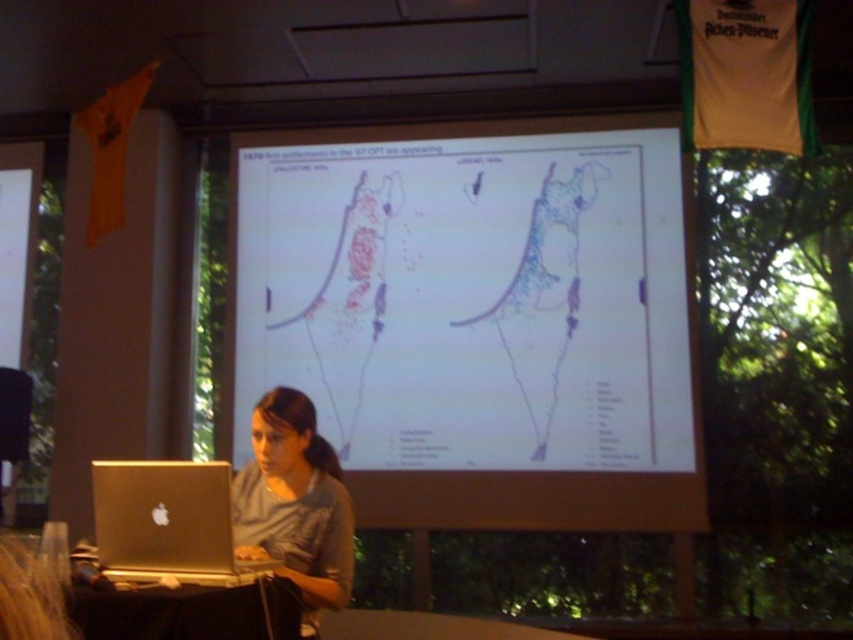
You are standing in the presentation room and see two points on the projection screen. The first point is labeled as point 1 at coordinates point (578, 316) and the second point is labeled as point 2 at coordinates point (204, 500). Which point is closer to you?

Point (578, 316) is further to the viewer than point (204, 500), so point (204, 500) is closer to you.

You are a presenter standing at the front of the room. You need to walk from your current position to the white matte map at center and then to the gray fabric shirt at center. Given that your stride length is 0.75 meters, how many steps will you take to reach the map first and then the shirt?

The white matte map at center is 1.66 meters away from the gray fabric shirt at center. To reach the map first, you would take approximately 2 steps since 1.66 divided by 0.75 is roughly 2.21, so rounding up to 3 steps. Wait, but the question says to walk from current position to the map then to the shirt. The distance between the map and shirt is 1.66 meters. However, the presenter starts at the front, so we need to know the distance from the presenter to the map. The problem doesn t provide that. Hmm, the